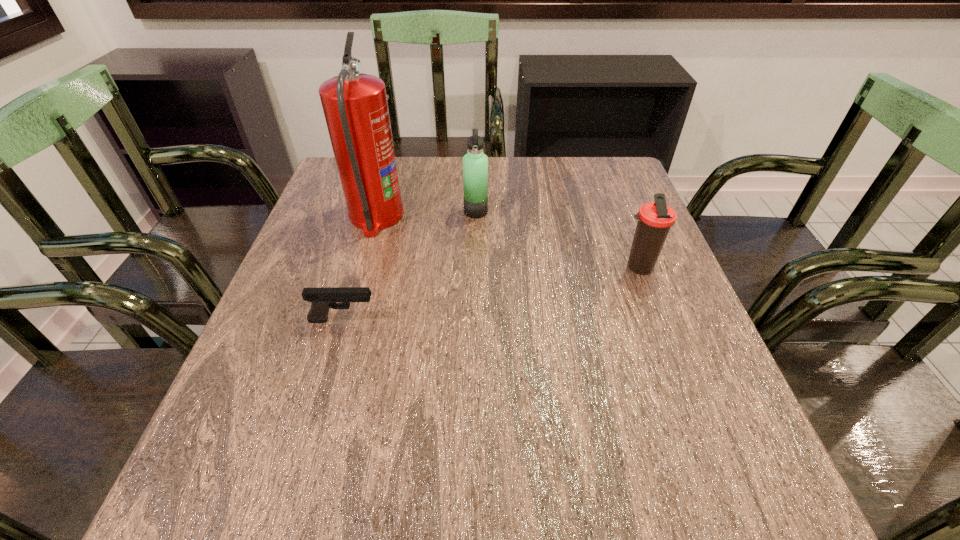
This screenshot has height=540, width=960. I want to click on vacant position located 0.340m on the front-facing side of the pistol, so click(548, 320).

Where is `object located in the far edge section of the desktop`? The width and height of the screenshot is (960, 540). object located in the far edge section of the desktop is located at coordinates (355, 106).

The height and width of the screenshot is (540, 960). Find the location of `fire extinguisher present at the left edge`. fire extinguisher present at the left edge is located at coordinates (355, 106).

Where is `pistol at the left edge`? The width and height of the screenshot is (960, 540). pistol at the left edge is located at coordinates (322, 299).

The image size is (960, 540). Find the location of `object present at the right edge`. object present at the right edge is located at coordinates (655, 219).

At what (x,y) coordinates should I click in order to perform the action: click on object located in the far left corner section of the desktop. Please return your answer as a coordinate pair (x, y). Image resolution: width=960 pixels, height=540 pixels. Looking at the image, I should click on (355, 106).

In the image, there is a desktop. Find the location of `vacant space at the far edge`. vacant space at the far edge is located at coordinates (x=562, y=179).

In the image, there is a desktop. At what (x,y) coordinates should I click in order to perform the action: click on free space at the near edge. Please return your answer as a coordinate pair (x, y). Image resolution: width=960 pixels, height=540 pixels. Looking at the image, I should click on (492, 469).

In the image, there is a desktop. At what (x,y) coordinates should I click in order to perform the action: click on free space at the left edge. Please return your answer as a coordinate pair (x, y). This screenshot has width=960, height=540. Looking at the image, I should click on (223, 422).

At what (x,y) coordinates should I click in order to perform the action: click on free space at the right edge. Please return your answer as a coordinate pair (x, y). Looking at the image, I should click on (670, 359).